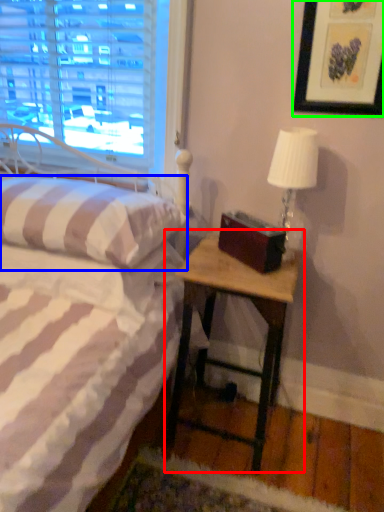
Question: Based on their relative distances, which object is nearer to nightstand (highlighted by a red box)? Choose from pillow (highlighted by a blue box) and picture frame (highlighted by a green box).

Choices:
 (A) pillow
 (B) picture frame

Answer: (A)